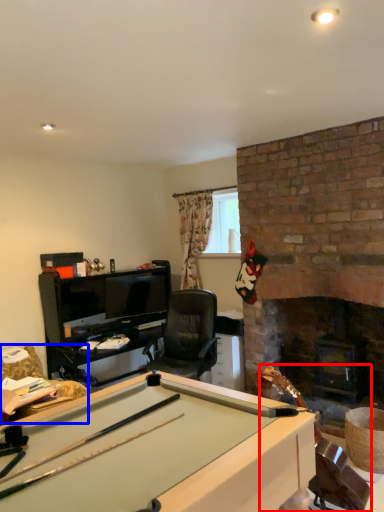
Question: Which object is further to the camera taking this photo, equipment (highlighted by a red box) or swivel chair (highlighted by a blue box)?

Choices:
 (A) equipment
 (B) swivel chair

Answer: (B)